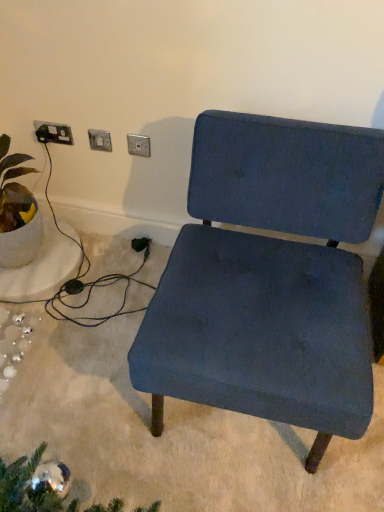
Question: Considering the positions of matte blue fabric chair at center and matte silver switch at upper center, which appears as the 2th electric outlet when viewed from the left, in the image, is matte blue fabric chair at center taller or shorter than matte silver switch at upper center, which appears as the 2th electric outlet when viewed from the left,?

Choices:
 (A) short
 (B) tall

Answer: (B)

Question: Is point (324, 188) positioned closer to the camera than point (102, 138)?

Choices:
 (A) farther
 (B) closer

Answer: (B)

Question: Which object is positioned farthest from the black plastic socket at upper left, placed as the 3th electric outlet when sorted from right to left?

Choices:
 (A) green leafy plant in white pot at left
 (B) matte silver switch at upper center, which appears as the 2th electric outlet when viewed from the left
 (C) metallic silver outlet at upper center, which is the third electric outlet in left-to-right order
 (D) matte blue fabric chair at center

Answer: (D)

Question: Which of these objects is positioned closest to the black plastic socket at upper left, the first electric outlet positioned from the left?

Choices:
 (A) metallic silver outlet at upper center, the 1th electric outlet from the right
 (B) matte silver switch at upper center, arranged as the second electric outlet when viewed from the right
 (C) green leafy plant in white pot at left
 (D) matte blue fabric chair at center

Answer: (B)